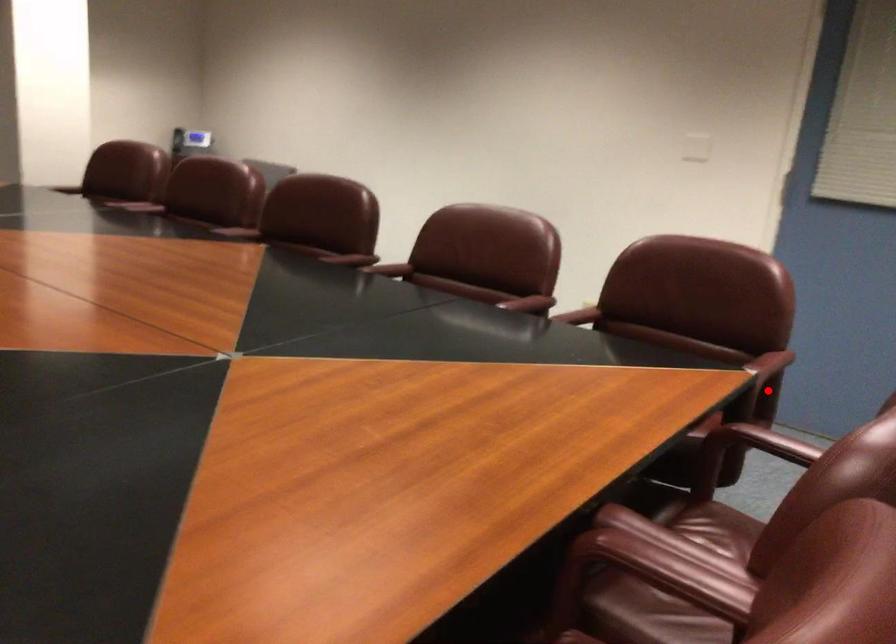
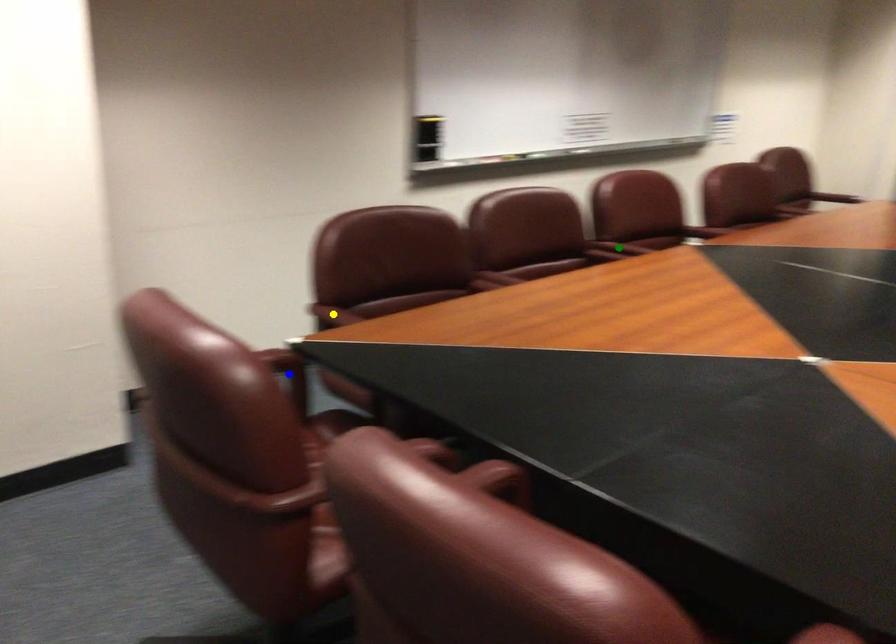
Question: I am providing you with two images of the same scene from different viewpoints. A red point is marked on the first image. You are given multiple points on the second image. Which point in image 2 represents the same 3d spot as the red point in image 1?

Choices:
 (A) yellow point
 (B) green point
 (C) blue point

Answer: (C)